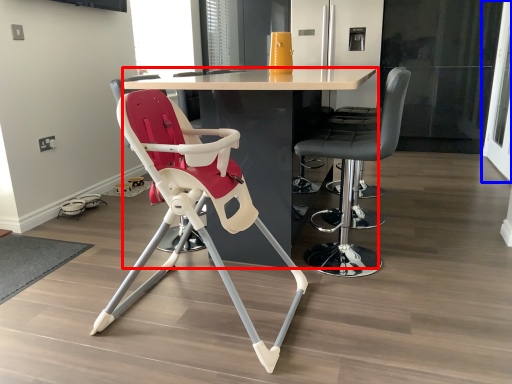
Question: Among these objects, which one is farthest to the camera, table (highlighted by a red box) or screen door (highlighted by a blue box)?

Choices:
 (A) table
 (B) screen door

Answer: (B)